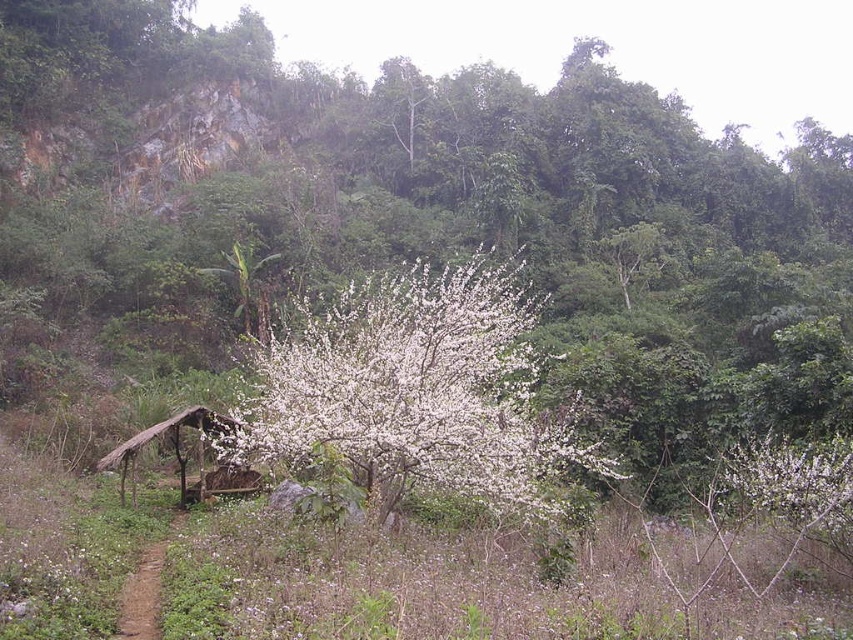
Question: Among these objects, which one is nearest to the camera?

Choices:
 (A) brown dirt path at lower left
 (B) thatched wood hut at center
 (C) white fluffy flowers at center
 (D) white fluffy blossoms at center

Answer: (A)

Question: Is white fluffy flowers at center bigger than brown dirt path at lower left?

Choices:
 (A) yes
 (B) no

Answer: (A)

Question: Is white fluffy blossoms at center bigger than brown dirt path at lower left?

Choices:
 (A) no
 (B) yes

Answer: (B)

Question: Is white fluffy blossoms at center behind thatched wood hut at center?

Choices:
 (A) no
 (B) yes

Answer: (A)

Question: Which object is positioned farthest from the thatched wood hut at center?

Choices:
 (A) white fluffy blossoms at center
 (B) brown dirt path at lower left

Answer: (B)

Question: Which object is positioned farthest from the brown dirt path at lower left?

Choices:
 (A) white fluffy flowers at center
 (B) white fluffy blossoms at center
 (C) thatched wood hut at center

Answer: (B)